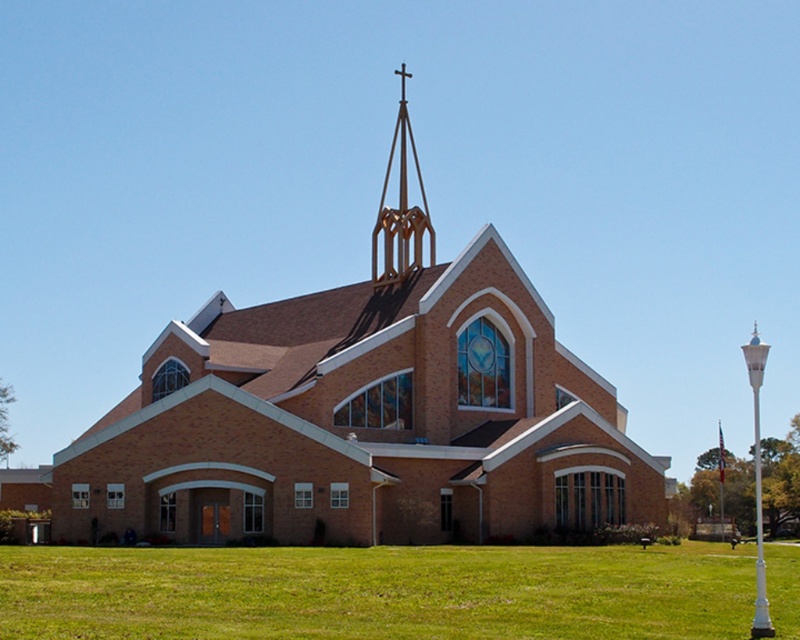
Question: Where is green grass at lower center located in relation to white glossy lamppost at right in the image?

Choices:
 (A) right
 (B) left

Answer: (B)

Question: Which object is positioned farthest from the gold metallic spire at upper center?

Choices:
 (A) white glossy lamppost at right
 (B) brown brick church at center

Answer: (A)

Question: Based on their relative distances, which object is nearer to the gold metallic spire at upper center?

Choices:
 (A) brown brick church at center
 (B) green grass at lower center

Answer: (A)

Question: Considering the relative positions of brown brick church at center and white glossy lamppost at right in the image provided, where is brown brick church at center located with respect to white glossy lamppost at right?

Choices:
 (A) above
 (B) below

Answer: (A)

Question: Among these objects, which one is farthest from the camera?

Choices:
 (A) white glossy lamppost at right
 (B) green grass at lower center
 (C) gold metallic spire at upper center
 (D) brown brick church at center

Answer: (C)

Question: Is green grass at lower center in front of gold metallic spire at upper center?

Choices:
 (A) yes
 (B) no

Answer: (A)